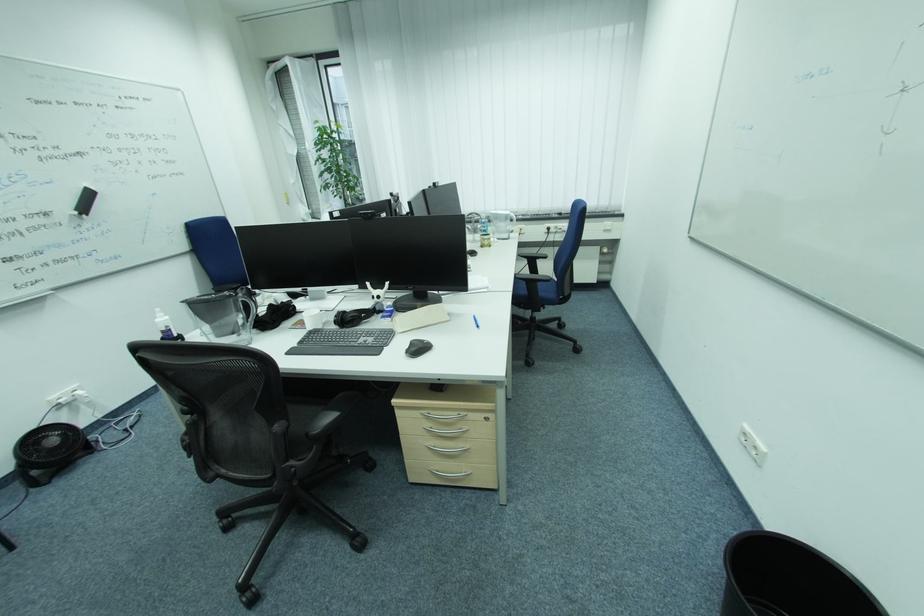
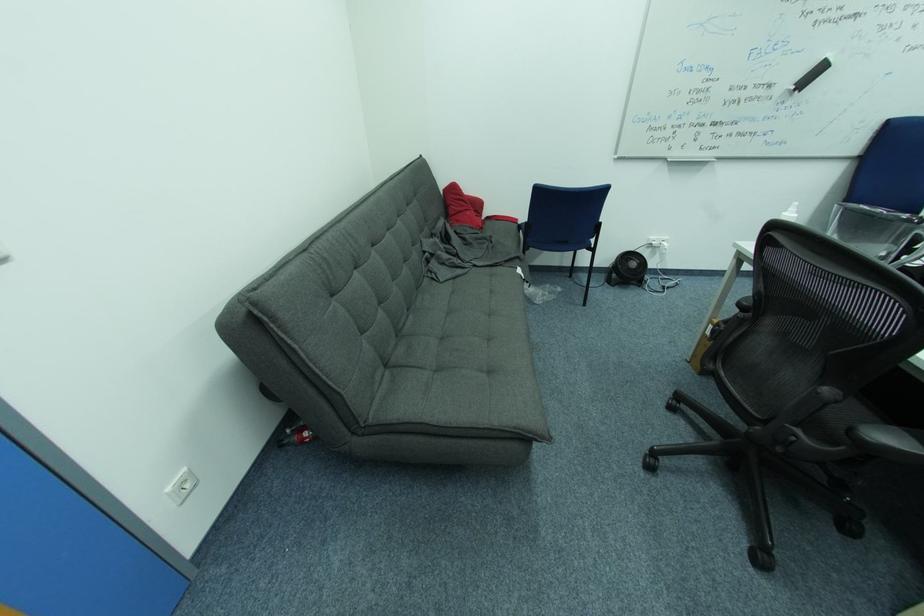
Question: I am providing you with two images of the same scene from different viewpoints. After the viewpoint changes to image2, which objects are now occluded?

Choices:
 (A) black chair armrest
 (B) white spray bottle
 (C) red pillow
 (D) none of these

Answer: (D)